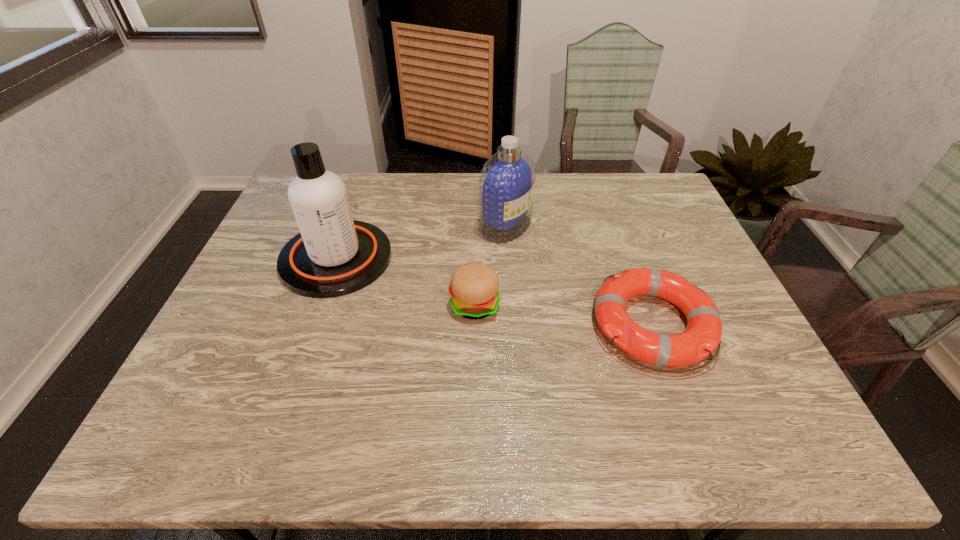
Locate an element on the screen. Image resolution: width=960 pixels, height=540 pixels. free space between the shortest object and the second tallest object is located at coordinates (579, 275).

Find the location of a particular element. This screenshot has height=540, width=960. unoccupied area between the second shortest object and the shortest object is located at coordinates (564, 314).

At what (x,y) coordinates should I click in order to perform the action: click on free space between the third shortest object and the third tallest object. Please return your answer as a coordinate pair (x, y). This screenshot has width=960, height=540. Looking at the image, I should click on (491, 265).

Where is `free point between the tallest object and the third tallest object`? This screenshot has width=960, height=540. free point between the tallest object and the third tallest object is located at coordinates coord(405,281).

This screenshot has height=540, width=960. I want to click on unoccupied position between the shorter cleansing agent and the taller cleansing agent, so click(421, 242).

The height and width of the screenshot is (540, 960). Find the location of `empty location between the hamburger and the rightmost object`. empty location between the hamburger and the rightmost object is located at coordinates [564, 314].

Point out which object is positioned as the third nearest to the rightmost object. Please provide its 2D coordinates. Your answer should be formatted as a tuple, i.e. [(x, y)], where the tuple contains the x and y coordinates of a point satisfying the conditions above.

[(333, 255)]

At what (x,y) coordinates should I click in order to perform the action: click on object that is the closest to the hamburger. Please return your answer as a coordinate pair (x, y). Image resolution: width=960 pixels, height=540 pixels. Looking at the image, I should click on (333, 255).

At what (x,y) coordinates should I click in order to perform the action: click on free point that satisfies the following two spatial constraints: 1. on the front side of the hamburger; 2. on the right side of the tallest object. Please return your answer as a coordinate pair (x, y). The height and width of the screenshot is (540, 960). Looking at the image, I should click on (320, 305).

I want to click on vacant area in the image that satisfies the following two spatial constraints: 1. on the front side of the tallest object; 2. on the left side of the hamburger, so click(320, 305).